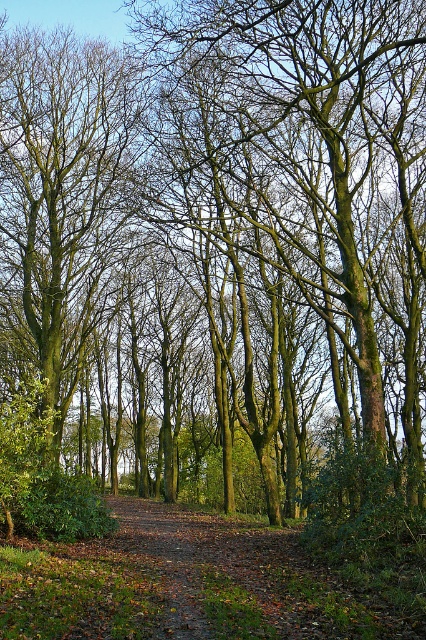
Which is above, green mossy tree at center or brown leafy path at center?

green mossy tree at center is above.

Does point (60, 220) come in front of point (104, 541)?

No, it is not.

Between point (91, 200) and point (203, 588), which one is positioned in front?

Positioned in front is point (203, 588).

At what (x,y) coordinates should I click in order to perform the action: click on green mossy tree at center. Please return your answer as a coordinate pair (x, y). This screenshot has width=426, height=640. Looking at the image, I should click on (63, 198).